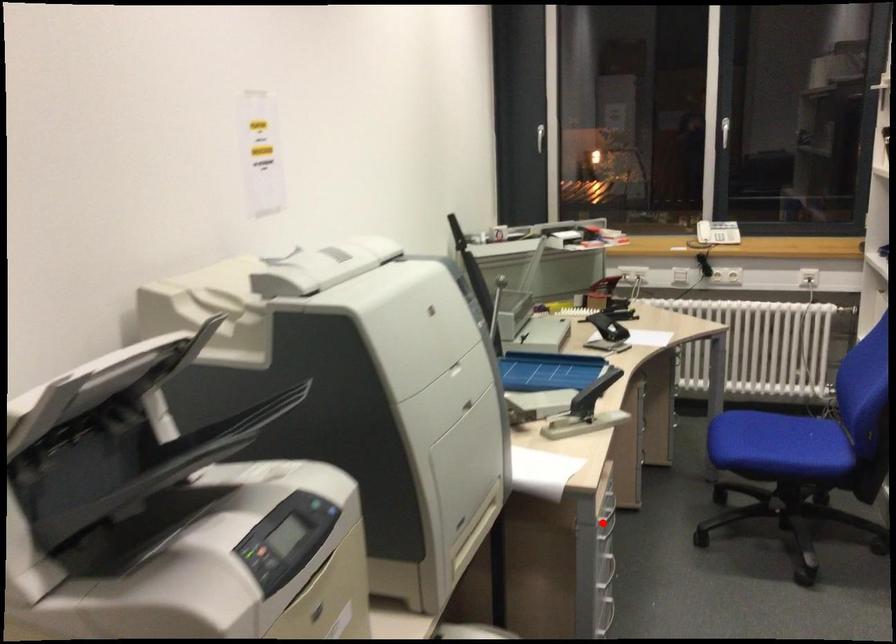
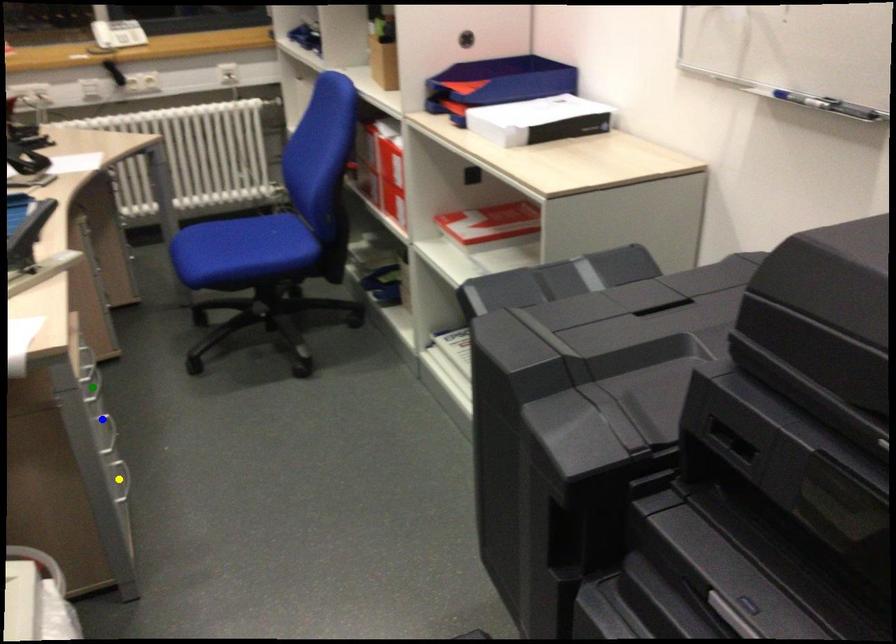
Question: I am providing you with two images of the same scene from different viewpoints. A red point is marked on the first image. You are given multiple points on the second image. In image 2, which mark is for the same physical point as the one in image 1?

Choices:
 (A) blue point
 (B) yellow point
 (C) green point

Answer: (C)